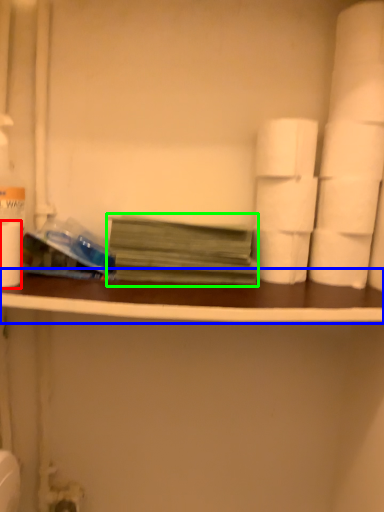
Question: Which object is the farthest from paper towel (highlighted by a red box)? Choose among these: ledge (highlighted by a blue box) or book (highlighted by a green box).

Choices:
 (A) ledge
 (B) book

Answer: (A)